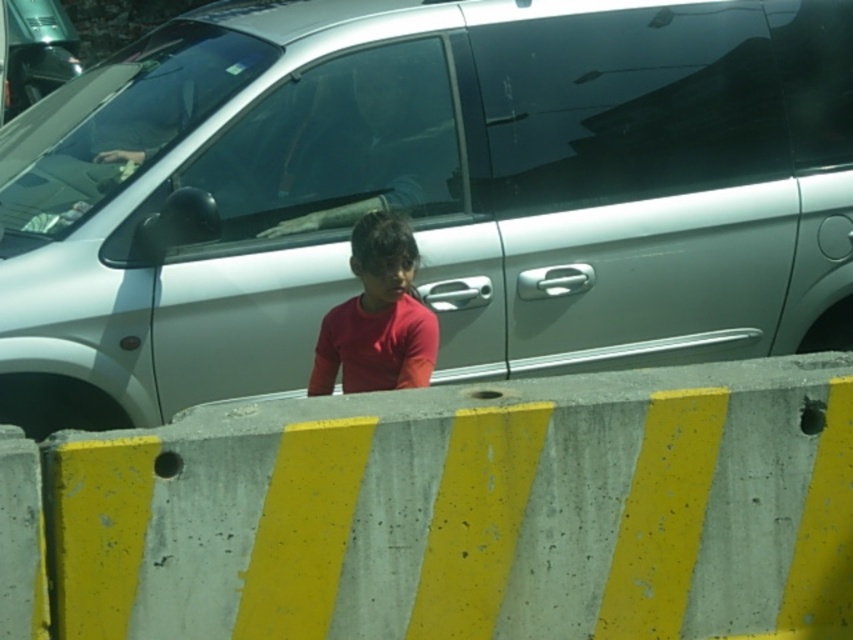
You are a delivery robot navigating an urban area. You need to deliver a package to a location marked by point (485, 385). However, there is an obstacle at point (263, 122). Can you safely navigate around the obstacle to reach your destination?

Point (263, 122) is behind point (485, 385), so the obstacle is behind the destination. Therefore, the delivery robot can safely navigate to the destination as the obstacle does not block the path.

You are a delivery person trying to deliver a package to a child wearing a red matte shirt at center. There is a silver metallic car at center blocking the path. Can you see the child clearly from your current position?

The silver metallic car at center is larger in size than the red matte shirt at center. Since the car is blocking the path and is larger, it might be obstructing the view of the child. You might not be able to see the child clearly until you move around the car.